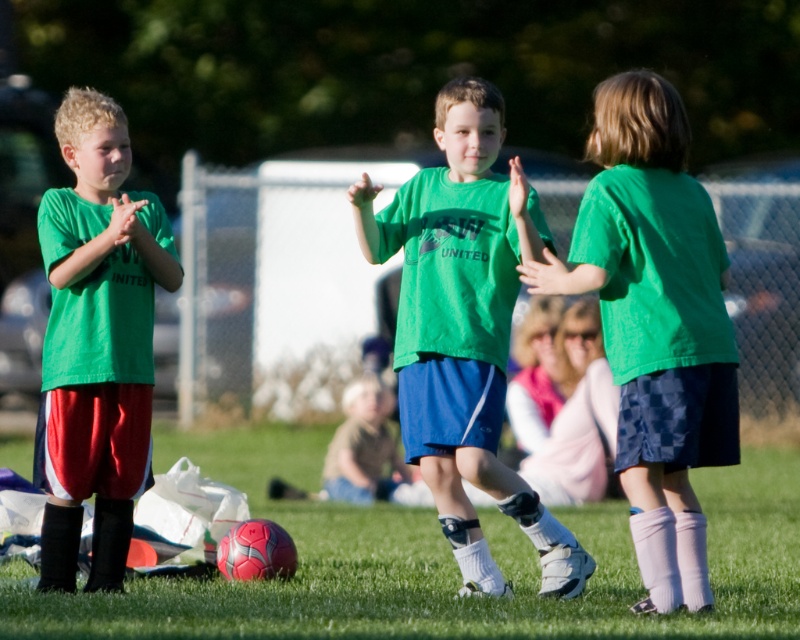
Question: Is matte green shirt at center smaller than matte green shirt at left?

Choices:
 (A) yes
 (B) no

Answer: (B)

Question: Which object is farther from the camera taking this photo?

Choices:
 (A) matte green shirt at center
 (B) green grass at lower center
 (C) matte green shirt at left

Answer: (C)

Question: Which of the following is the farthest from the observer?

Choices:
 (A) (730, 419)
 (B) (574, 616)

Answer: (A)

Question: Can you confirm if matte green shirt at center is positioned to the left of matte green shirt at left?

Choices:
 (A) no
 (B) yes

Answer: (A)

Question: Which point is farther to the camera?

Choices:
 (A) (722, 326)
 (B) (741, 490)
 (C) (580, 552)

Answer: (B)

Question: Can you confirm if matte green shirt at center is wider than matte green shirt at left?

Choices:
 (A) no
 (B) yes

Answer: (B)